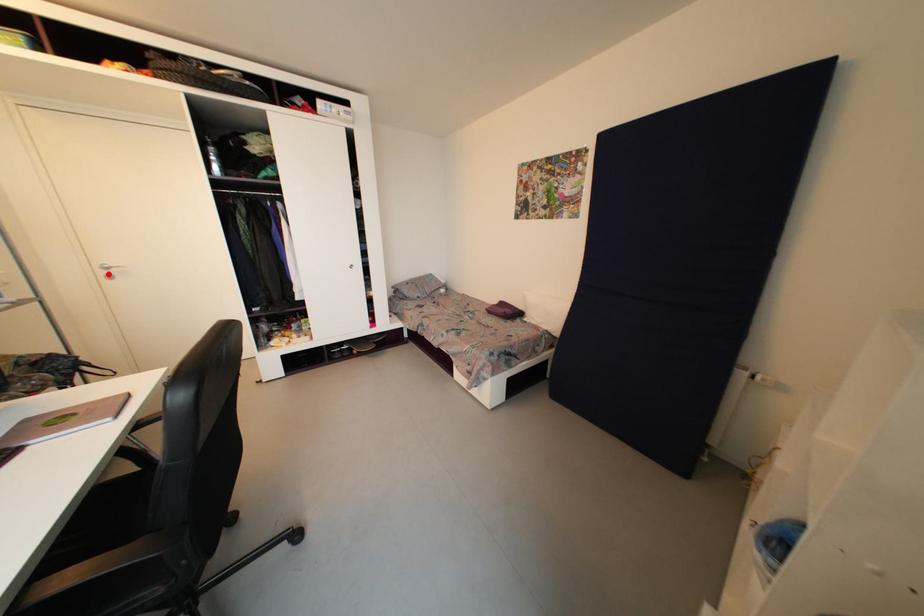
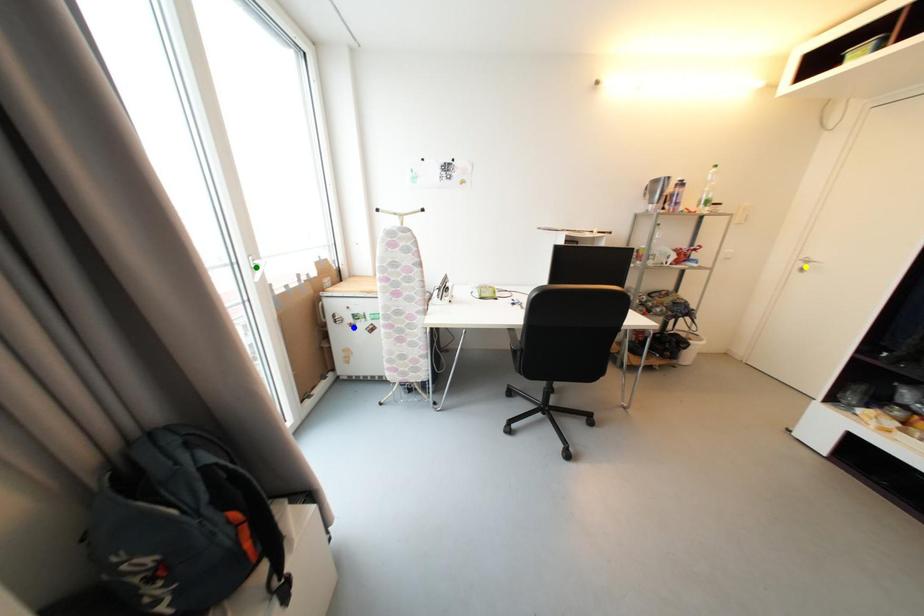
Question: I am providing you with two images of the same scene from different viewpoints. A red point is marked on the first image. You are given multiple points on the second image. Can you choose the point in image 2 that corresponds to the point in image 1?

Choices:
 (A) yellow point
 (B) blue point
 (C) green point

Answer: (A)